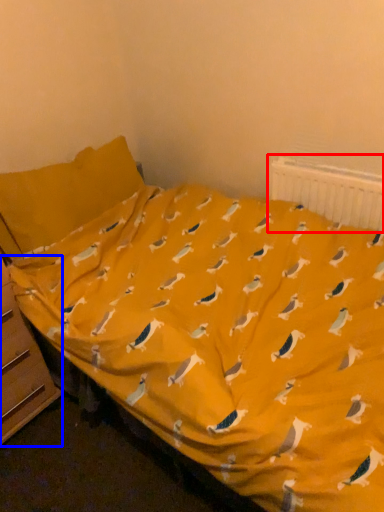
Question: Among these objects, which one is nearest to the camera, radiator (highlighted by a red box) or file cabinet (highlighted by a blue box)?

Choices:
 (A) radiator
 (B) file cabinet

Answer: (B)